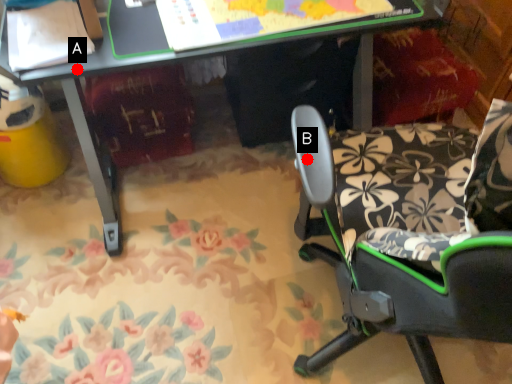
Question: Two points are circled on the image, labeled by A and B beside each circle. Which of the following is the closest to the observer?

Choices:
 (A) A is closer
 (B) B is closer

Answer: (B)